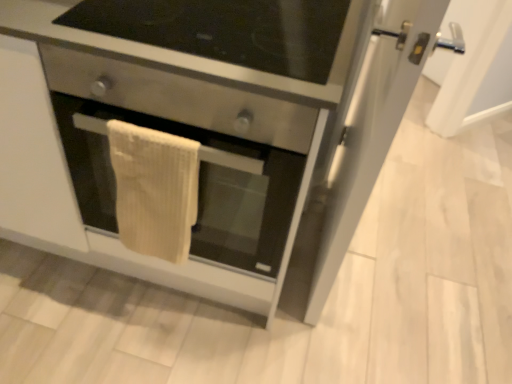
Question: Could you tell me if stainless steel oven at center is facing stainless steel drawer at center?

Choices:
 (A) yes
 (B) no

Answer: (B)

Question: Is stainless steel oven at center bigger than stainless steel drawer at center?

Choices:
 (A) yes
 (B) no

Answer: (A)

Question: Is stainless steel oven at center far from stainless steel drawer at center?

Choices:
 (A) yes
 (B) no

Answer: (B)

Question: Can you confirm if stainless steel oven at center is positioned to the right of stainless steel drawer at center?

Choices:
 (A) no
 (B) yes

Answer: (A)

Question: From the image's perspective, is stainless steel oven at center over stainless steel drawer at center?

Choices:
 (A) yes
 (B) no

Answer: (B)

Question: Considering the relative sizes of stainless steel oven at center and stainless steel drawer at center in the image provided, is stainless steel oven at center smaller than stainless steel drawer at center?

Choices:
 (A) yes
 (B) no

Answer: (B)

Question: Is beige textured towel at center at the right side of stainless steel drawer at center?

Choices:
 (A) no
 (B) yes

Answer: (A)

Question: Can you confirm if beige textured towel at center is bigger than stainless steel drawer at center?

Choices:
 (A) yes
 (B) no

Answer: (B)

Question: Is stainless steel drawer at center located within beige textured towel at center?

Choices:
 (A) no
 (B) yes

Answer: (A)

Question: Is beige textured towel at center in front of stainless steel drawer at center?

Choices:
 (A) no
 (B) yes

Answer: (A)

Question: Is beige textured towel at center next to stainless steel drawer at center?

Choices:
 (A) yes
 (B) no

Answer: (B)

Question: Does beige textured towel at center have a greater width compared to stainless steel drawer at center?

Choices:
 (A) no
 (B) yes

Answer: (A)

Question: Does beige textured towel at center appear on the right side of stainless steel oven at center?

Choices:
 (A) no
 (B) yes

Answer: (A)